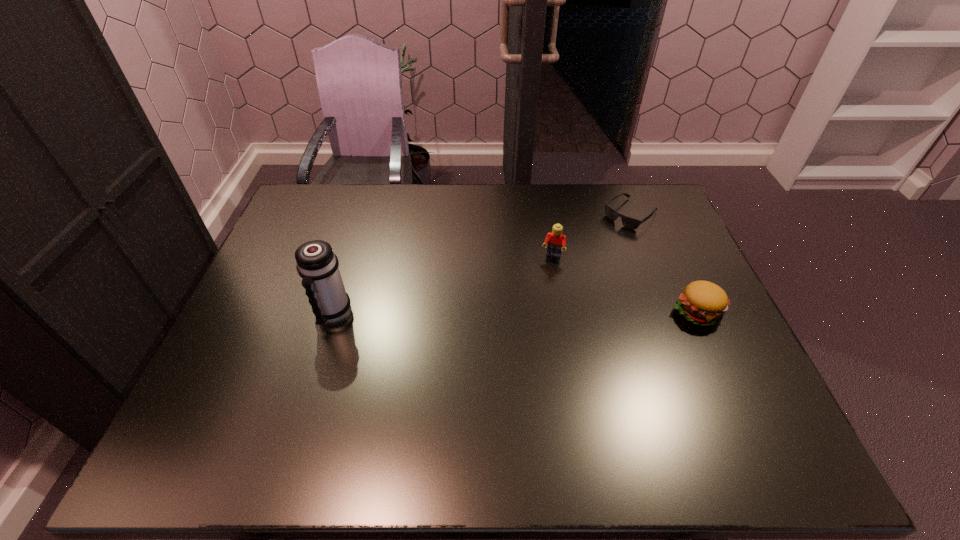
Locate an element on the screen. blank space located 0.290m on the face of the second tallest object is located at coordinates (529, 335).

The image size is (960, 540). I want to click on vacant space positioned on the face of the second tallest object, so click(521, 364).

Where is `free space located on the front-facing side of the farthest object`? This screenshot has width=960, height=540. free space located on the front-facing side of the farthest object is located at coordinates (553, 278).

This screenshot has height=540, width=960. What are the coordinates of `blank area located 0.340m on the front-facing side of the farthest object` in the screenshot? It's located at (551, 279).

Identify the location of blank space located on the front-facing side of the farthest object. (604, 237).

I want to click on object positioned at the far edge, so click(x=632, y=223).

Where is `hamburger located at the right edge`? This screenshot has height=540, width=960. hamburger located at the right edge is located at coordinates (703, 303).

Locate an element on the screen. The image size is (960, 540). sunglasses at the right edge is located at coordinates (632, 223).

Image resolution: width=960 pixels, height=540 pixels. In order to click on object located at the far right corner in this screenshot , I will do `click(632, 223)`.

Identify the location of free point at the far edge. The width and height of the screenshot is (960, 540). (612, 194).